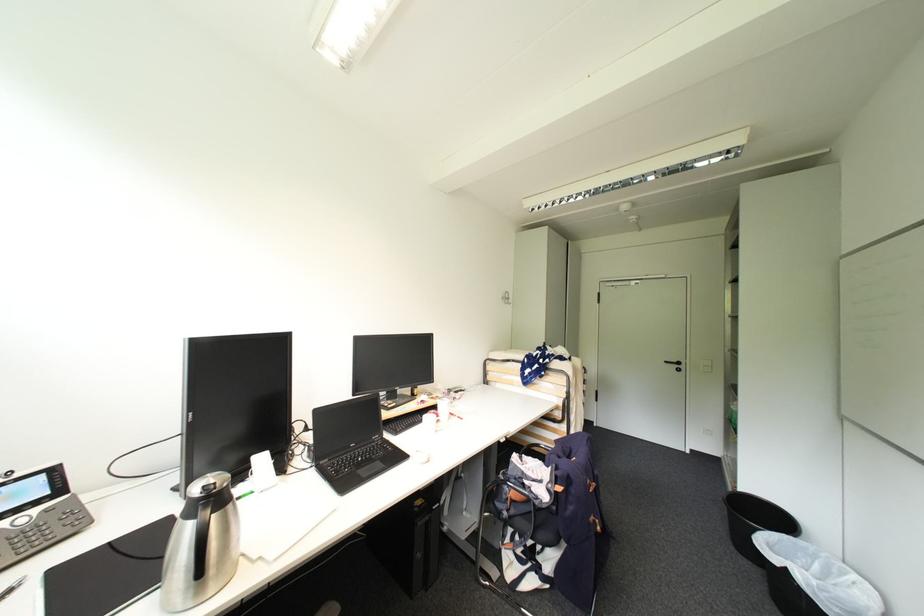
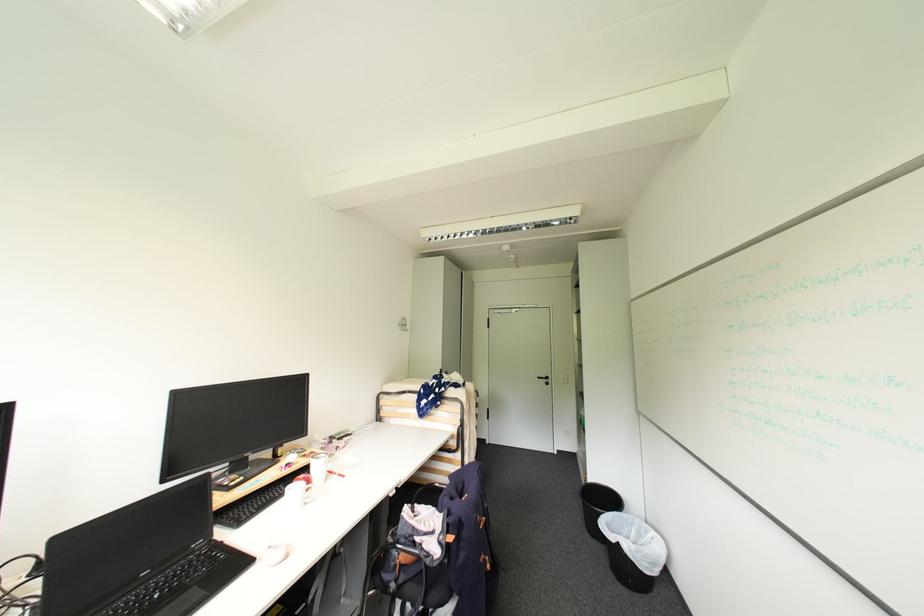
In the second image, find the point that corresponds to pixel 418 459 in the first image.

(263, 562)